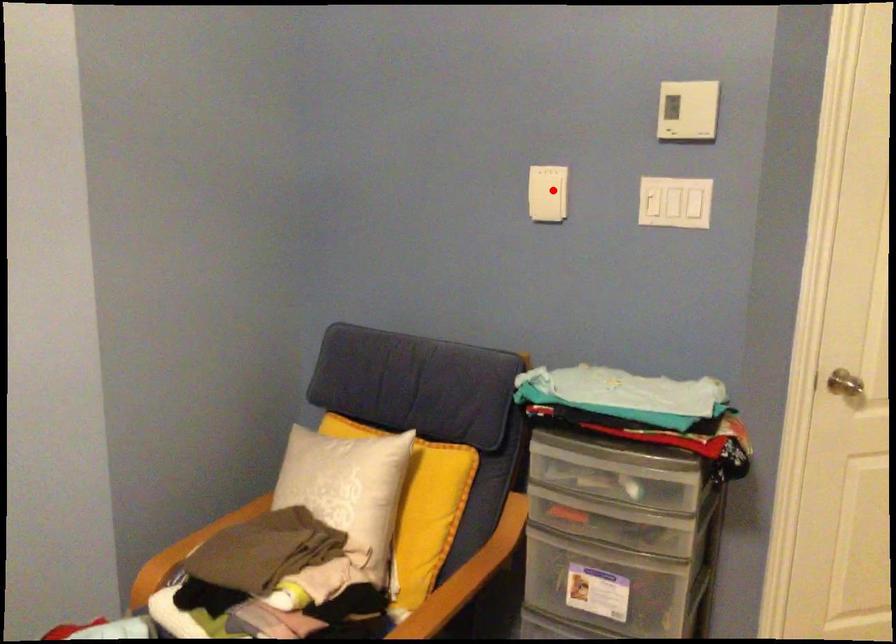
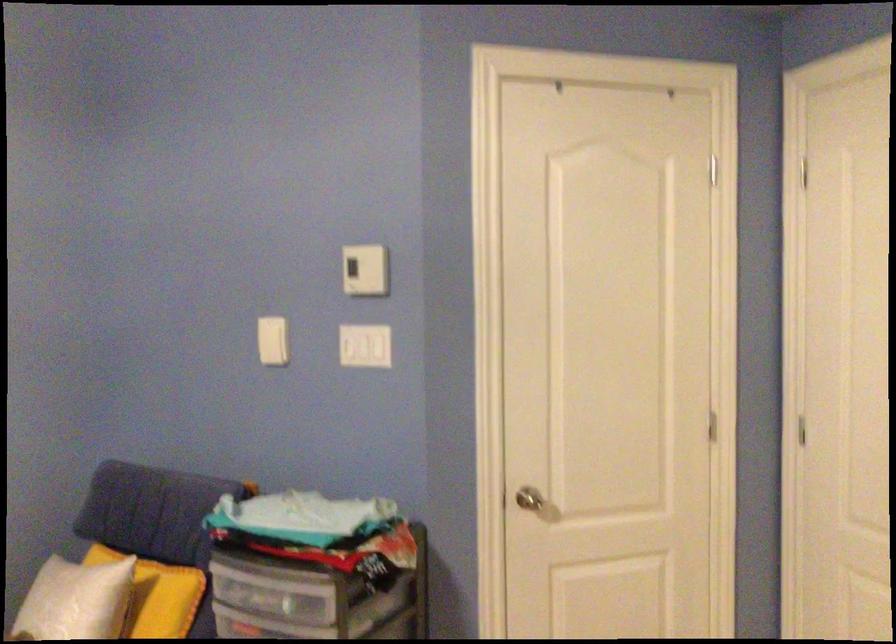
Question: I am providing you with two images of the same scene from different viewpoints. Image1 has a red point marked. In image2, the corresponding 3D location appears at what relative position? Reply with the corresponding letter.

Choices:
 (A) Closer
 (B) Farther

Answer: (B)